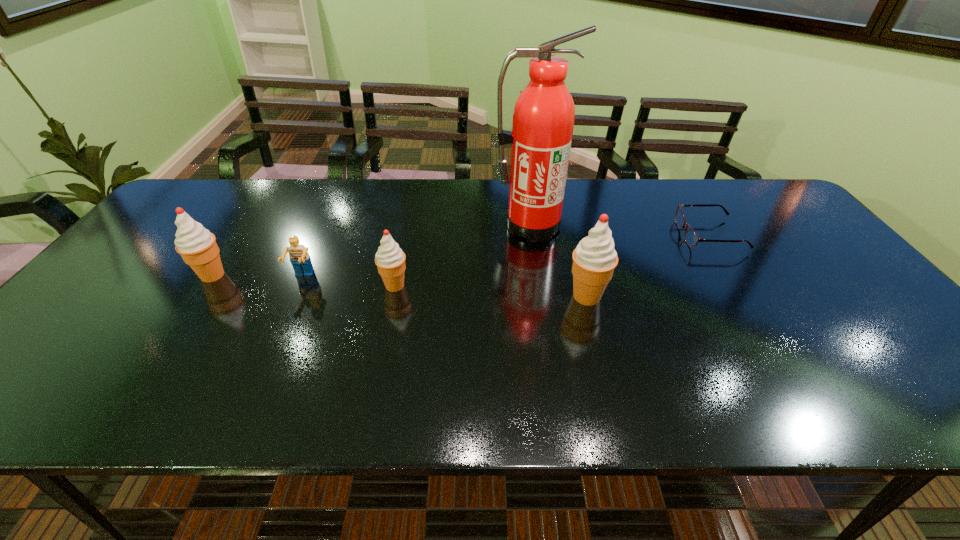
At what (x,y) coordinates should I click in order to perform the action: click on the third tallest object. Please return your answer as a coordinate pair (x, y). Image resolution: width=960 pixels, height=540 pixels. Looking at the image, I should click on (197, 246).

Find the location of a particular element. This screenshot has width=960, height=540. the leftmost object is located at coordinates (197, 246).

Where is `the fourth tallest object`? This screenshot has width=960, height=540. the fourth tallest object is located at coordinates (390, 259).

Locate an element on the screen. the fourth object from right to left is located at coordinates (390, 259).

Where is `the rightmost icecream`? the rightmost icecream is located at coordinates pos(594,259).

This screenshot has width=960, height=540. Identify the location of the tallest object. (543, 120).

The width and height of the screenshot is (960, 540). I want to click on the shortest object, so click(691, 238).

Image resolution: width=960 pixels, height=540 pixels. Find the location of `the rightmost object`. the rightmost object is located at coordinates (691, 238).

You are a GUI agent. You are given a task and a screenshot of the screen. Output one action in this format:
    pyautogui.click(x=<x>, y=<y>)
    Task: Click on the fifth object from right to left
    The height and width of the screenshot is (540, 960).
    Given the screenshot: What is the action you would take?
    pyautogui.click(x=299, y=257)

Where is `Lego`? This screenshot has height=540, width=960. Lego is located at coordinates (299, 257).